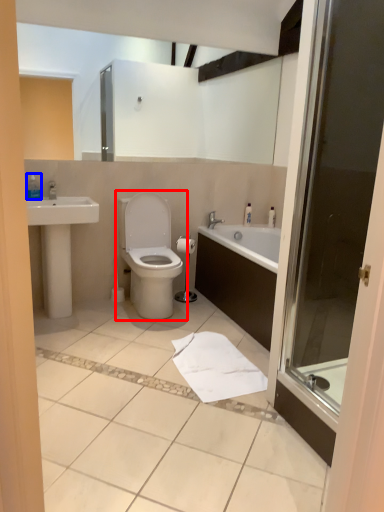
Question: Which object is further to the camera taking this photo, toilet (highlighted by a red box) or toiletry (highlighted by a blue box)?

Choices:
 (A) toilet
 (B) toiletry

Answer: (B)